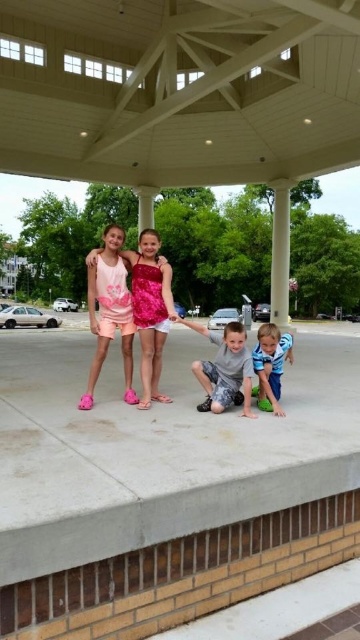
Question: Does shiny pink dress at center lie behind gray camouflage pants at center?

Choices:
 (A) yes
 (B) no

Answer: (A)

Question: Which point appears closest to the camera in this image?

Choices:
 (A) (164, 292)
 (B) (218, 387)
 (C) (285, 321)
 (D) (266, 346)

Answer: (B)

Question: Which of the following is the farthest from the observer?

Choices:
 (A) blue cotton shirt at lower right
 (B) white smooth column at center
 (C) gray camouflage pants at center
 (D) shiny pink dress at center

Answer: (B)

Question: Does gray camouflage pants at center lie behind blue cotton shirt at lower right?

Choices:
 (A) yes
 (B) no

Answer: (B)

Question: Is gray camouflage pants at center closer to camera compared to white smooth column at center?

Choices:
 (A) yes
 (B) no

Answer: (A)

Question: Which object is the closest to the white smooth column at center?

Choices:
 (A) shiny pink dress at center
 (B) gray camouflage pants at center
 (C) blue cotton shirt at lower right

Answer: (A)